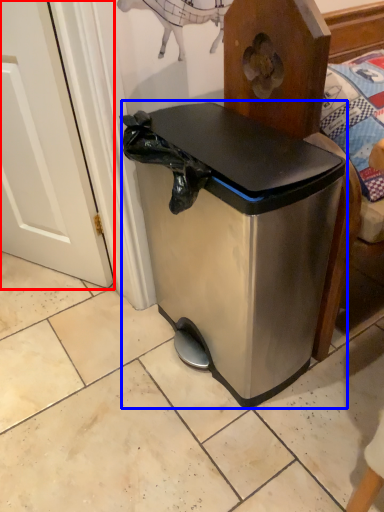
Question: Among these objects, which one is nearest to the camera, screen door (highlighted by a red box) or waste container (highlighted by a blue box)?

Choices:
 (A) screen door
 (B) waste container

Answer: (B)